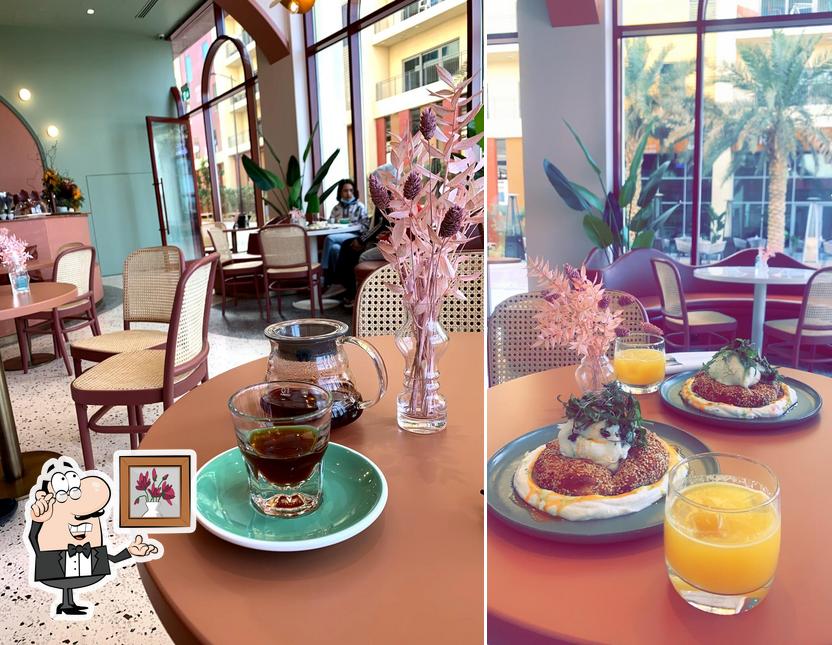
Locate an element on the screen. table is located at coordinates point(404,550), point(804,468), point(745,273), point(329,224), point(50,295), point(38,264).